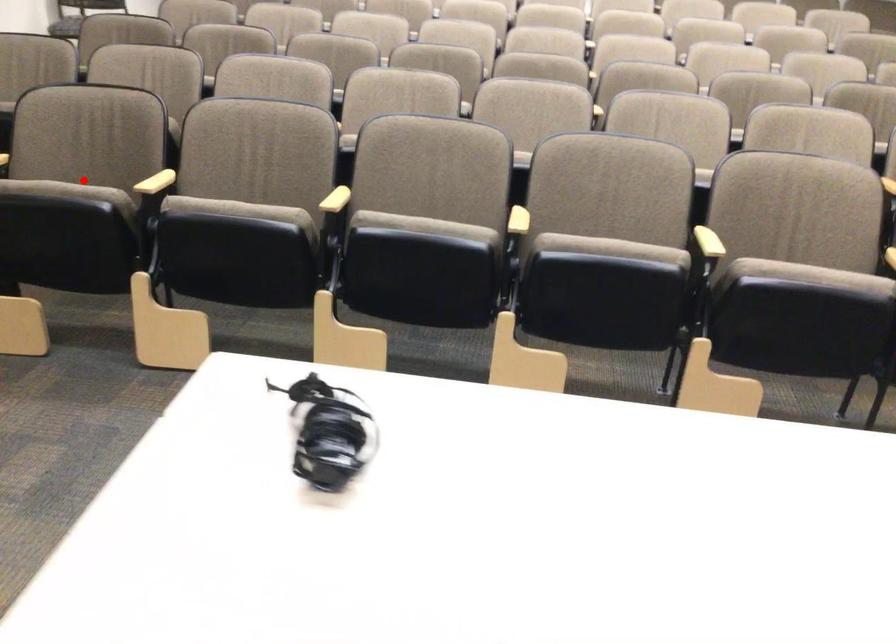
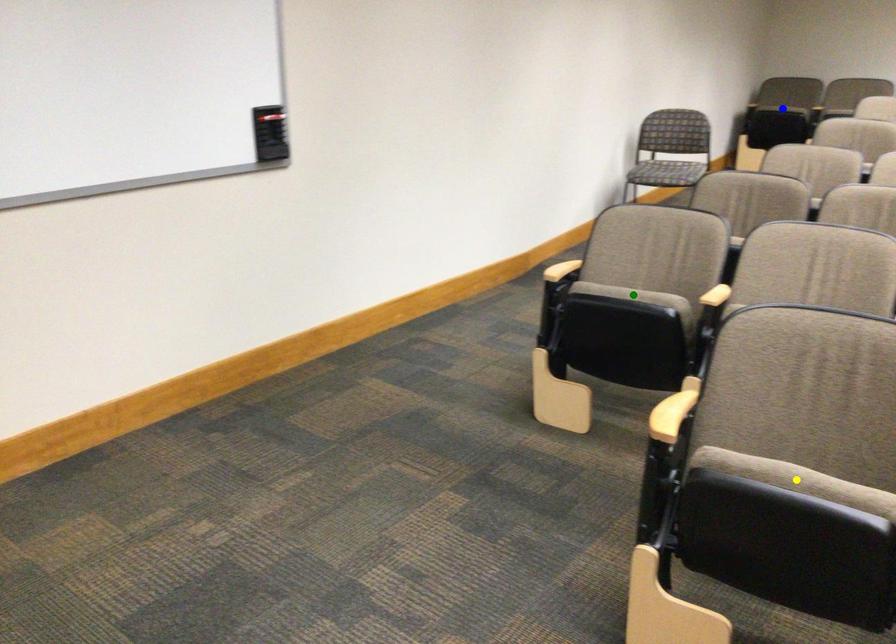
Question: I am providing you with two images of the same scene from different viewpoints. A red point is marked on the first image. You are given multiple points on the second image. Can you choose the point in image 2 that corresponds to the point in image 1?

Choices:
 (A) yellow point
 (B) green point
 (C) blue point

Answer: (A)